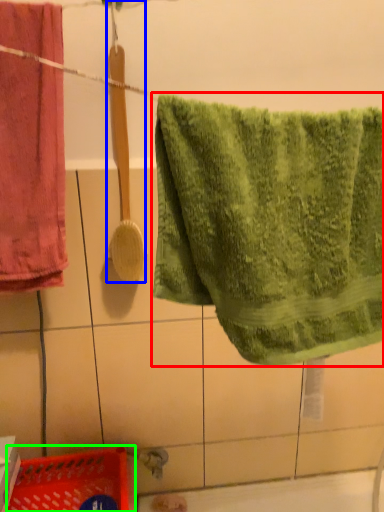
Question: Estimate the real-world distances between objects in this image. Which object is closer to towel (highlighted by a red box), brush (highlighted by a blue box) or basket (highlighted by a green box)?

Choices:
 (A) brush
 (B) basket

Answer: (A)